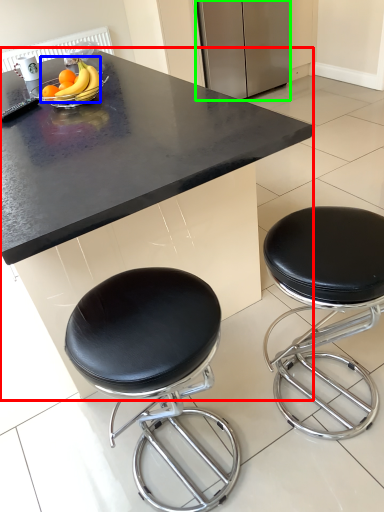
Question: Which is nearer to the table (highlighted by a red box)? banana (highlighted by a blue box) or appliance (highlighted by a green box).

Choices:
 (A) banana
 (B) appliance

Answer: (A)